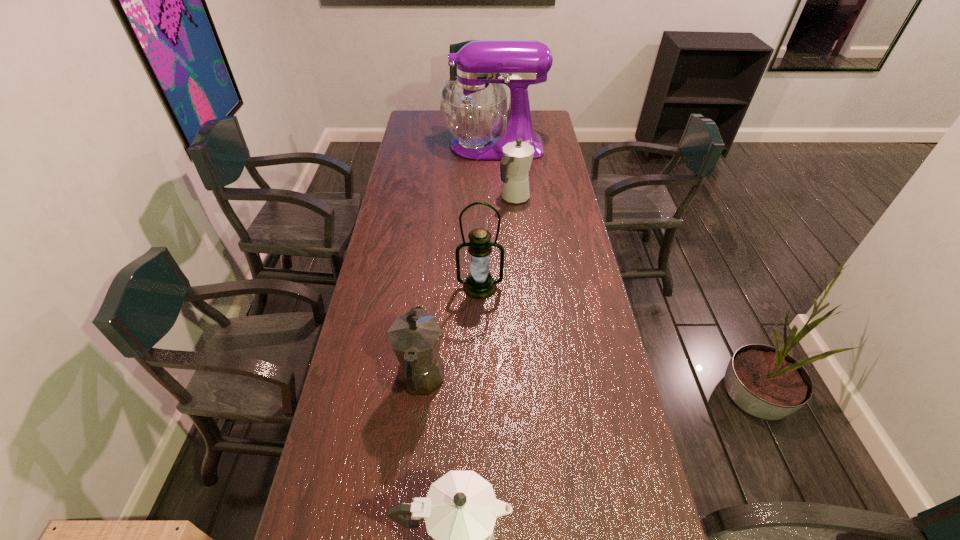
Where is `vacant space that is in between the second tallest object and the farthest object`? Image resolution: width=960 pixels, height=540 pixels. vacant space that is in between the second tallest object and the farthest object is located at coordinates (487, 217).

At what (x,y) coordinates should I click in order to perform the action: click on empty location between the lantern and the fourth farthest object. Please return your answer as a coordinate pair (x, y). Looking at the image, I should click on (450, 333).

Identify the location of free area in between the second farthest coffeepot and the fourth shortest object. The width and height of the screenshot is (960, 540). (450, 333).

At what (x,y) coordinates should I click in order to perform the action: click on vacant region between the third farthest object and the second nearest object. Please return your answer as a coordinate pair (x, y). The width and height of the screenshot is (960, 540). Looking at the image, I should click on (450, 333).

Where is `vacant area that lies between the second farthest coffeepot and the fourth shortest object`? The image size is (960, 540). vacant area that lies between the second farthest coffeepot and the fourth shortest object is located at coordinates (450, 333).

Find the location of a particular element. Image resolution: width=960 pixels, height=540 pixels. free space between the farthest object and the third nearest object is located at coordinates (487, 217).

Identify the location of empty space that is in between the tallest object and the third nearest object. This screenshot has width=960, height=540. (487, 217).

At what (x,y) coordinates should I click in order to perform the action: click on object that ranks as the fourth closest to the second nearest coffeepot. Please return your answer as a coordinate pair (x, y). The width and height of the screenshot is (960, 540). Looking at the image, I should click on (473, 107).

Where is `object that is the fourth closest to the mixer`? The width and height of the screenshot is (960, 540). object that is the fourth closest to the mixer is located at coordinates (460, 510).

Point out which coffeepot is positioned as the nearest to the farthest coffeepot. Please provide its 2D coordinates. Your answer should be formatted as a tuple, i.e. [(x, y)], where the tuple contains the x and y coordinates of a point satisfying the conditions above.

[(415, 337)]